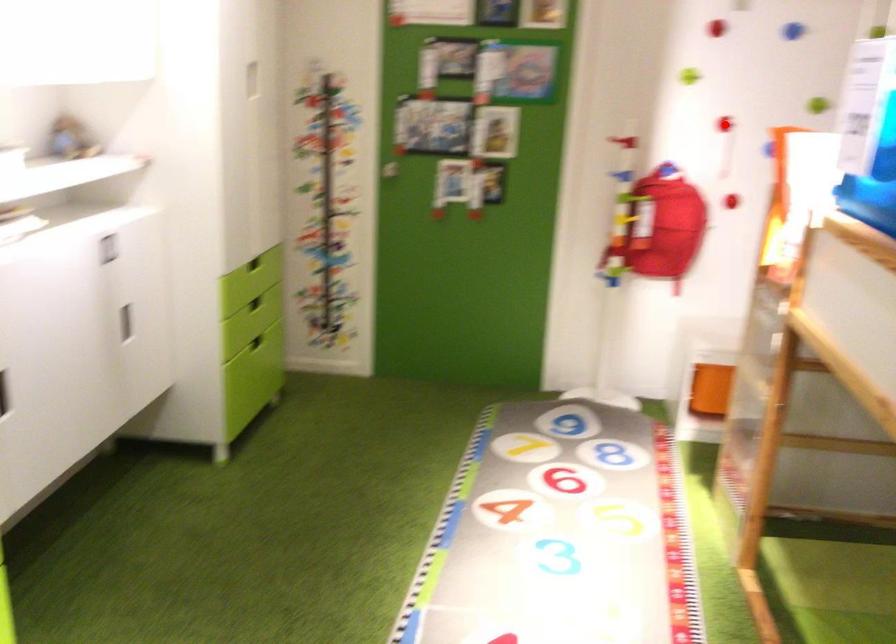
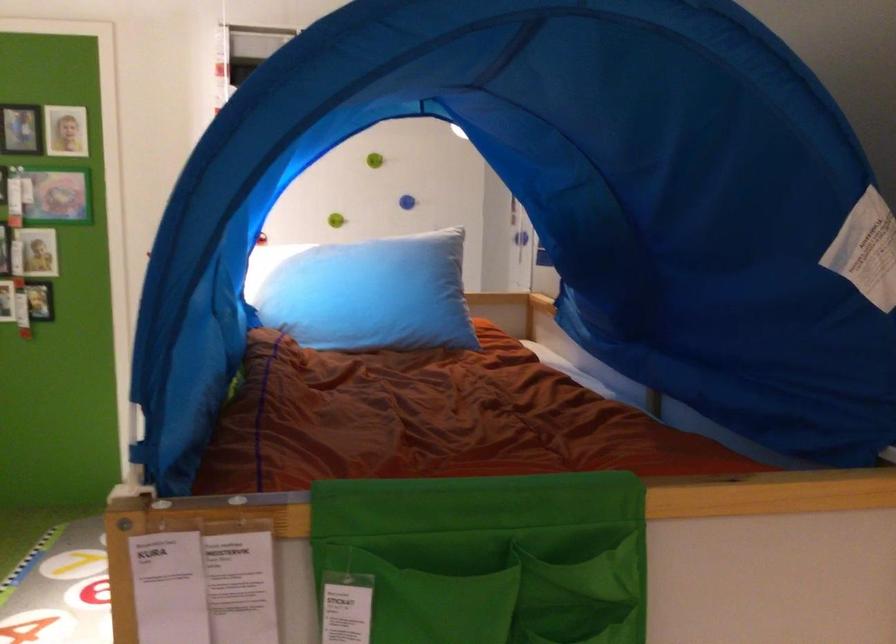
Question: I am providing you with two images of the same scene from different viewpoints. A red point is marked on the first image. Is the red point's position out of view in image 2?

Choices:
 (A) Yes
 (B) No

Answer: (A)